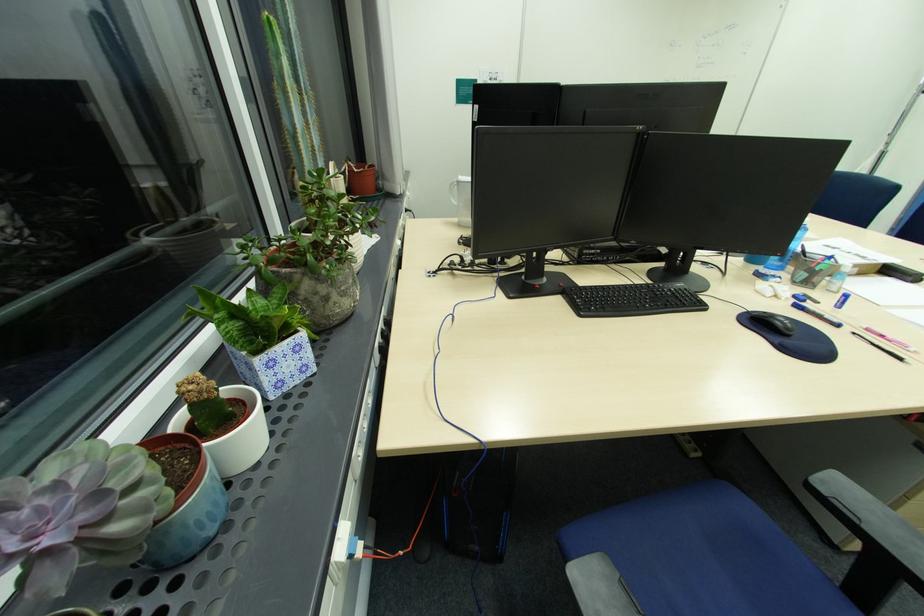
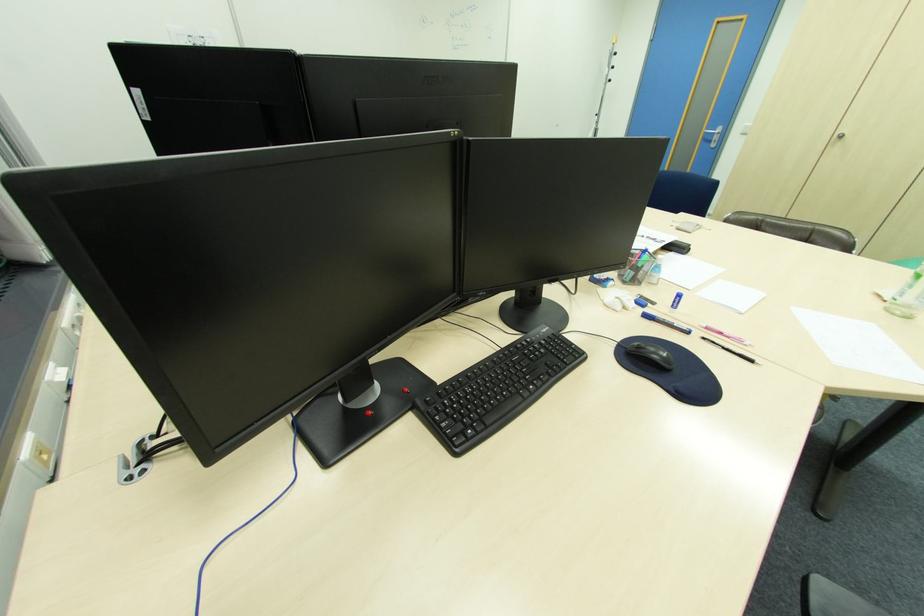
Find the pixel in the second image that matches point 810,276 in the first image.

(637, 274)